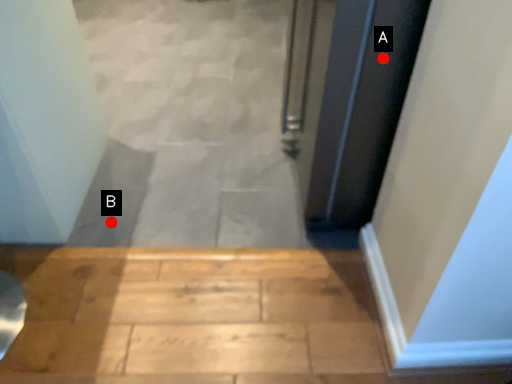
Question: Two points are circled on the image, labeled by A and B beside each circle. Which point appears farthest from the camera in this image?

Choices:
 (A) A is further
 (B) B is further

Answer: (B)